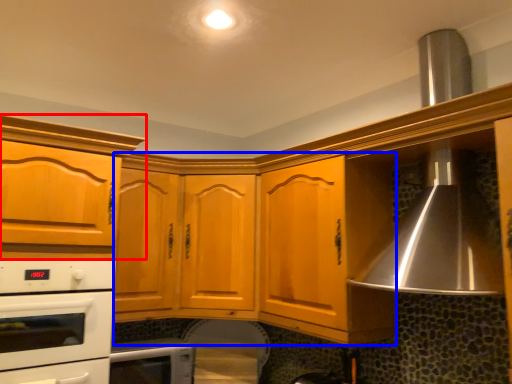
Question: Among these objects, which one is farthest to the camera, cabinetry (highlighted by a red box) or cabinetry (highlighted by a blue box)?

Choices:
 (A) cabinetry
 (B) cabinetry

Answer: (B)